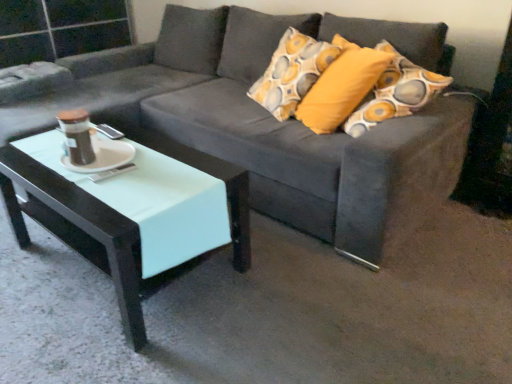
Question: Considering the relative sizes of mint glossy coffee table at lower left and suede gray couch at center in the image provided, is mint glossy coffee table at lower left shorter than suede gray couch at center?

Choices:
 (A) yes
 (B) no

Answer: (A)

Question: Does mint glossy coffee table at lower left have a greater height compared to suede gray couch at center?

Choices:
 (A) no
 (B) yes

Answer: (A)

Question: Does mint glossy coffee table at lower left appear on the right side of suede gray couch at center?

Choices:
 (A) no
 (B) yes

Answer: (A)

Question: From a real-world perspective, is mint glossy coffee table at lower left on suede gray couch at center?

Choices:
 (A) no
 (B) yes

Answer: (A)

Question: Considering the relative sizes of mint glossy coffee table at lower left and suede gray couch at center in the image provided, is mint glossy coffee table at lower left wider than suede gray couch at center?

Choices:
 (A) yes
 (B) no

Answer: (B)

Question: From a real-world perspective, relative to suede gray couch at center, is mint glossy coffee table at lower left vertically above or below?

Choices:
 (A) below
 (B) above

Answer: (A)

Question: Looking at the image, does mint glossy coffee table at lower left seem bigger or smaller compared to suede gray couch at center?

Choices:
 (A) small
 (B) big

Answer: (A)

Question: From the image's perspective, is mint glossy coffee table at lower left located above or below suede gray couch at center?

Choices:
 (A) above
 (B) below

Answer: (B)

Question: In terms of width, does mint glossy coffee table at lower left look wider or thinner when compared to suede gray couch at center?

Choices:
 (A) thin
 (B) wide

Answer: (A)

Question: Is white glossy saucer at center wider or thinner than suede gray couch at center?

Choices:
 (A) wide
 (B) thin

Answer: (B)

Question: Based on their sizes in the image, would you say white glossy saucer at center is bigger or smaller than suede gray couch at center?

Choices:
 (A) small
 (B) big

Answer: (A)

Question: Considering the relative positions of white glossy saucer at center and suede gray couch at center in the image provided, is white glossy saucer at center to the left or to the right of suede gray couch at center?

Choices:
 (A) right
 (B) left

Answer: (B)

Question: From a real-world perspective, relative to suede gray couch at center, is white glossy saucer at center vertically above or below?

Choices:
 (A) below
 (B) above

Answer: (B)

Question: From a real-world perspective, is suede gray couch at center physically located above or below mint glossy coffee table at lower left?

Choices:
 (A) below
 (B) above

Answer: (B)

Question: From the image's perspective, is suede gray couch at center above or below mint glossy coffee table at lower left?

Choices:
 (A) below
 (B) above

Answer: (B)